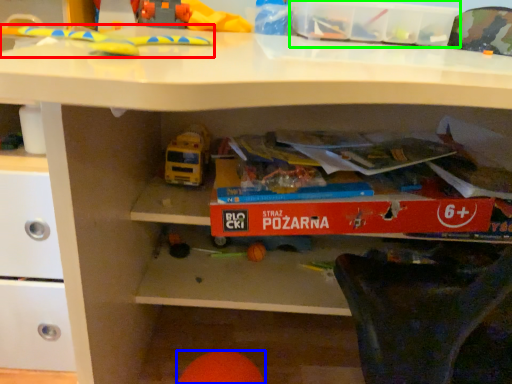
Question: Considering the real-world distances, which object is farthest from toy (highlighted by a red box)? toy (highlighted by a blue box) or storage box (highlighted by a green box)?

Choices:
 (A) toy
 (B) storage box

Answer: (A)